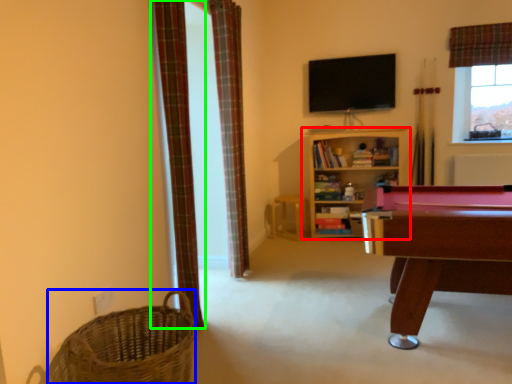
Question: Based on their relative distances, which object is farther from shelf (highlighted by a red box)? Choose from basket (highlighted by a blue box) and curtain (highlighted by a green box).

Choices:
 (A) basket
 (B) curtain

Answer: (A)